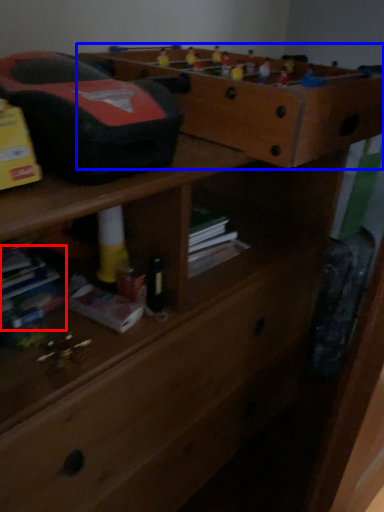
Question: Among these objects, which one is farthest to the camera, book (highlighted by a red box) or shelf (highlighted by a blue box)?

Choices:
 (A) book
 (B) shelf

Answer: (A)